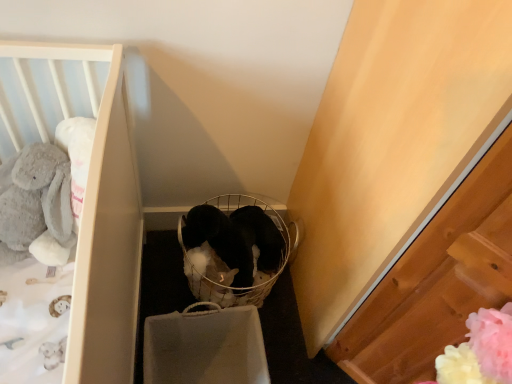
Describe the element at coordinates (233, 250) in the screenshot. I see `black plush baby carriage at center` at that location.

Where is `black plush baby carriage at center`? Image resolution: width=512 pixels, height=384 pixels. black plush baby carriage at center is located at coordinates (233, 250).

Does soft gray plush rabbit at left have a lesser width compared to white crib at left?

Yes.

I want to click on furniture on the right side of soft gray plush rabbit at left, so click(x=87, y=193).

Which object is closer to the camera taking this photo, soft gray plush rabbit at left or white crib at left?

white crib at left.

Looking at their sizes, would you say soft gray plush rabbit at left is wider or thinner than black plush baby carriage at center?

soft gray plush rabbit at left is thinner than black plush baby carriage at center.

Which object is positioned more to the right, soft gray plush rabbit at left or black plush baby carriage at center?

black plush baby carriage at center.

From a real-world perspective, which object stands above the other?

From a 3D spatial view, soft gray plush rabbit at left is above.

Identify the location of baby carriage below the soft gray plush rabbit at left (from the image's perspective). The image size is (512, 384). (233, 250).

From the image's perspective, is white crib at left below black plush baby carriage at center?

Actually, white crib at left appears above black plush baby carriage at center in the image.

Considering the relative sizes of white crib at left and black plush baby carriage at center in the image provided, is white crib at left bigger than black plush baby carriage at center?

Incorrect, white crib at left is not larger than black plush baby carriage at center.

Considering the sizes of white crib at left and black plush baby carriage at center in the image, is white crib at left wider or thinner than black plush baby carriage at center?

In the image, white crib at left appears to be more narrow than black plush baby carriage at center.

How different are the orientations of white crib at left and black plush baby carriage at center in degrees?

13.2 degrees separate the facing orientations of white crib at left and black plush baby carriage at center.

From a real-world perspective, does black plush baby carriage at center sit lower than white crib at left?

Indeed, from a real-world perspective, black plush baby carriage at center is positioned beneath white crib at left.

Considering the points (194, 266) and (84, 63), which point is in front, point (194, 266) or point (84, 63)?

The point (84, 63) is more forward.

Can we say black plush baby carriage at center lies outside white crib at left?

black plush baby carriage at center is positioned outside white crib at left.

Does white crib at left have a lesser width compared to soft gray plush rabbit at left?

Incorrect, the width of white crib at left is not less than that of soft gray plush rabbit at left.

Is white crib at left inside the boundaries of soft gray plush rabbit at left, or outside?

white crib at left is spatially situated outside soft gray plush rabbit at left.

Is white crib at left turned away from soft gray plush rabbit at left?

No.

Which of these two, white crib at left or soft gray plush rabbit at left, stands taller?

soft gray plush rabbit at left is taller.

Is black plush baby carriage at center bigger than soft gray plush rabbit at left?

Yes, black plush baby carriage at center is bigger than soft gray plush rabbit at left.

Considering the positions of point (216, 302) and point (50, 230), is point (216, 302) closer or farther from the camera than point (50, 230)?

Point (216, 302).

Between black plush baby carriage at center and soft gray plush rabbit at left, which one appears on the left side from the viewer's perspective?

Positioned to the left is soft gray plush rabbit at left.

I want to click on furniture below the soft gray plush rabbit at left (from the image's perspective), so click(x=87, y=193).

At what (x,y) coordinates should I click in order to perform the action: click on baby carriage behind the soft gray plush rabbit at left. Please return your answer as a coordinate pair (x, y). Looking at the image, I should click on (233, 250).

Based on the photo, based on their spatial positions, is soft gray plush rabbit at left or black plush baby carriage at center closer to white crib at left?

soft gray plush rabbit at left is closer to white crib at left.

Which object lies nearer to the anchor point white crib at left, black plush baby carriage at center or soft gray plush rabbit at left?

The object closer to white crib at left is soft gray plush rabbit at left.

Based on their spatial positions, is soft gray plush rabbit at left or white crib at left further from black plush baby carriage at center?

The object further to black plush baby carriage at center is soft gray plush rabbit at left.

Which object lies further to the anchor point black plush baby carriage at center, white crib at left or soft gray plush rabbit at left?

The object further to black plush baby carriage at center is soft gray plush rabbit at left.

Considering their positions, is white crib at left positioned further to soft gray plush rabbit at left than black plush baby carriage at center?

Among the two, black plush baby carriage at center is located further to soft gray plush rabbit at left.

Based on their spatial positions, is black plush baby carriage at center or white crib at left further from soft gray plush rabbit at left?

black plush baby carriage at center is positioned further to the anchor soft gray plush rabbit at left.

At what (x,y) coordinates should I click in order to perform the action: click on animal between white crib at left and black plush baby carriage at center along the z-axis. Please return your answer as a coordinate pair (x, y). Looking at the image, I should click on (37, 201).